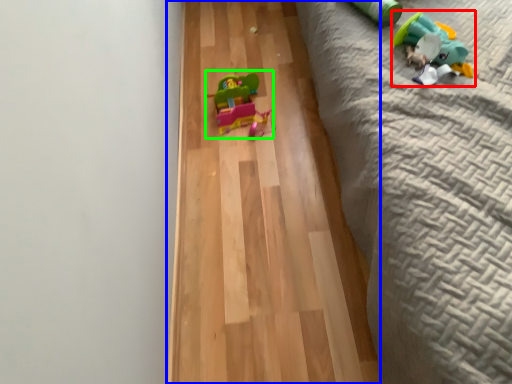
Question: Estimate the real-world distances between objects in this image. Which object is closer to toy (highlighted by a red box), hardwood (highlighted by a blue box) or toy (highlighted by a green box)?

Choices:
 (A) hardwood
 (B) toy

Answer: (A)